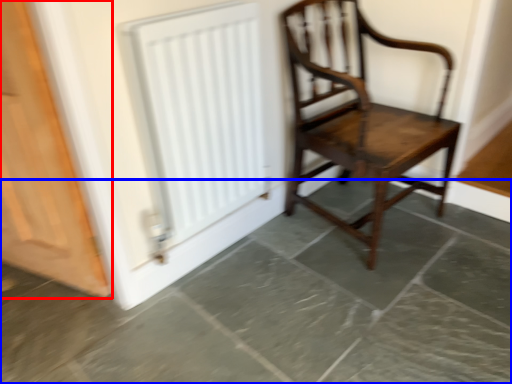
Question: Which object appears farthest to the camera in this image, door (highlighted by a red box) or concrete (highlighted by a blue box)?

Choices:
 (A) door
 (B) concrete

Answer: (A)